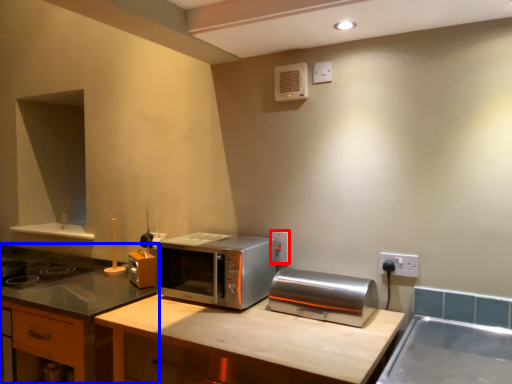
Question: Which object appears closest to the camera in this image, electric outlet (highlighted by a red box) or cabinetry (highlighted by a blue box)?

Choices:
 (A) electric outlet
 (B) cabinetry

Answer: (B)